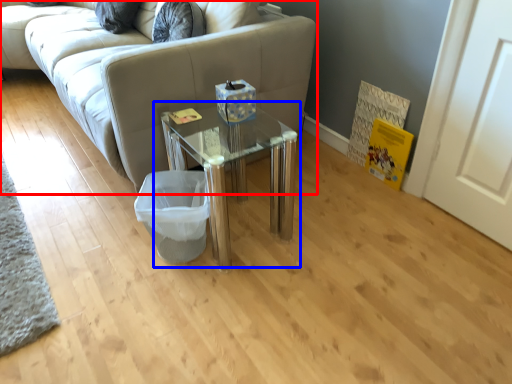
Question: Which object appears farthest to the camera in this image, studio couch (highlighted by a red box) or table (highlighted by a blue box)?

Choices:
 (A) studio couch
 (B) table

Answer: (A)